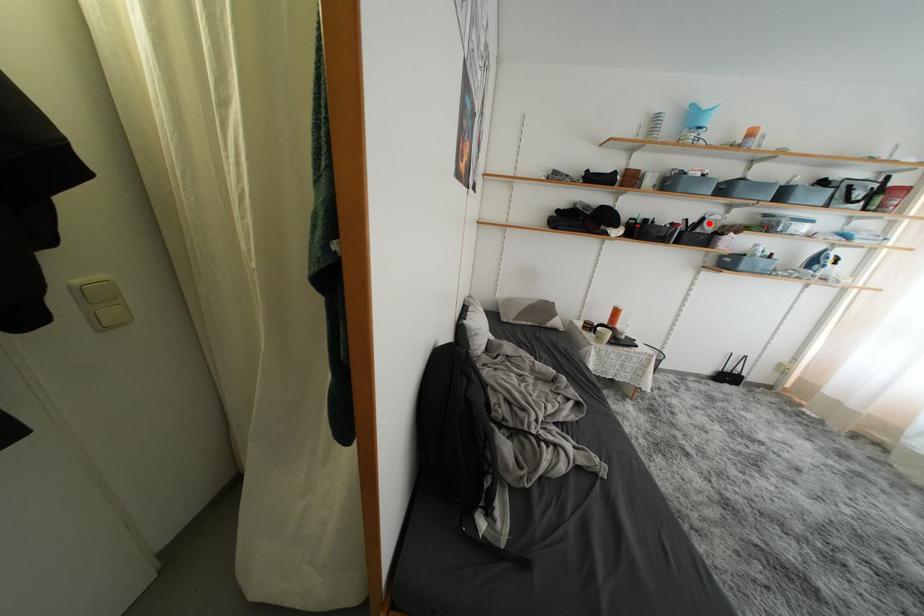
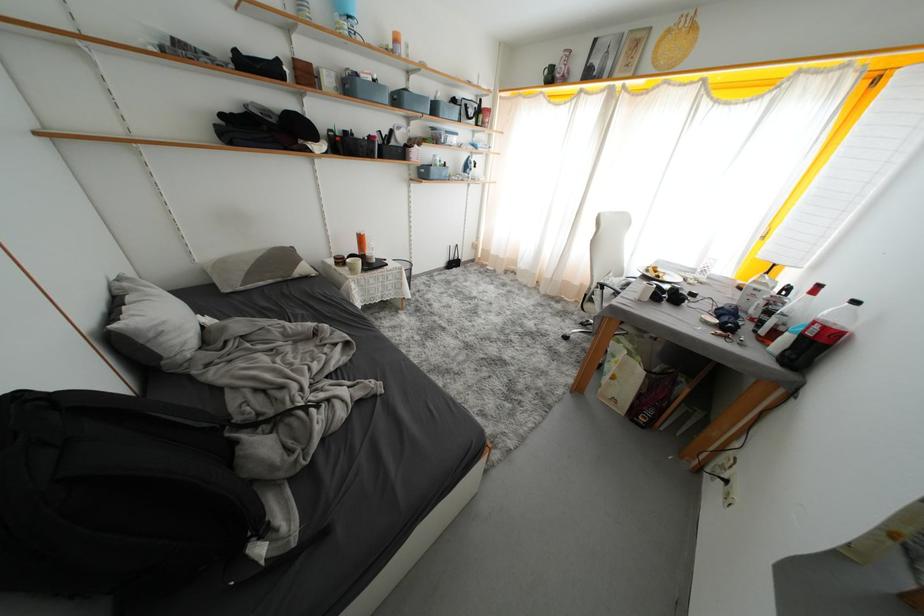
In the second image, find the point that corresponds to the highlighted location in the first image.

(397, 136)